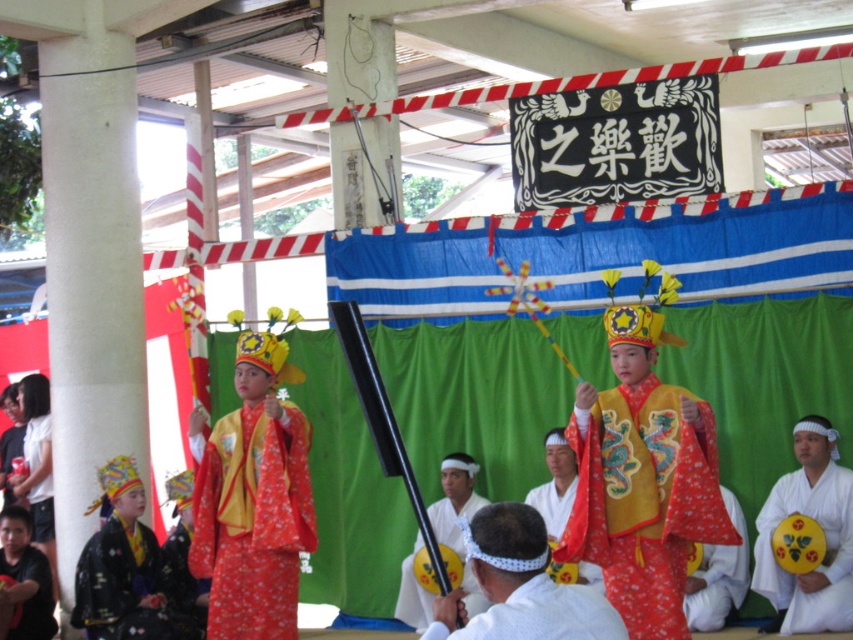
Question: Based on their relative distances, which object is farther from the smooth black stick at center?

Choices:
 (A) black silk kimono at lower left
 (B) white matte/soft karate uniform at lower right
 (C) floral silk robe at center

Answer: (B)

Question: Can you confirm if floral silk robe at center is smaller than red satin kimono at lower left?

Choices:
 (A) no
 (B) yes

Answer: (A)

Question: Does white cotton kimono at center have a smaller size compared to red satin kimono at lower left?

Choices:
 (A) no
 (B) yes

Answer: (A)

Question: Which point is closer to the camera?

Choices:
 (A) (519, 637)
 (B) (120, 566)
 (C) (473, 602)
 (D) (28, 440)

Answer: (A)

Question: Based on their relative distances, which object is nearer to the white matte/soft karate uniform at lower right?

Choices:
 (A) white cotton kimono at center
 (B) matte red kimono at left
 (C) smooth black stick at center
 (D) black silk kimono at lower left

Answer: (A)

Question: Is red satin kimono at lower left to the right of matte red kimono at left from the viewer's perspective?

Choices:
 (A) yes
 (B) no

Answer: (A)